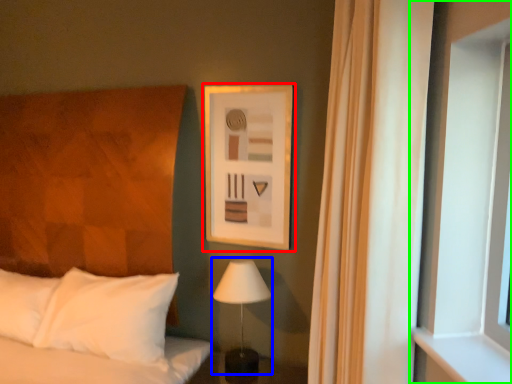
Question: Which is farther away from picture frame (highlighted by a red box)? table lamp (highlighted by a blue box) or window (highlighted by a green box)?

Choices:
 (A) table lamp
 (B) window

Answer: (B)